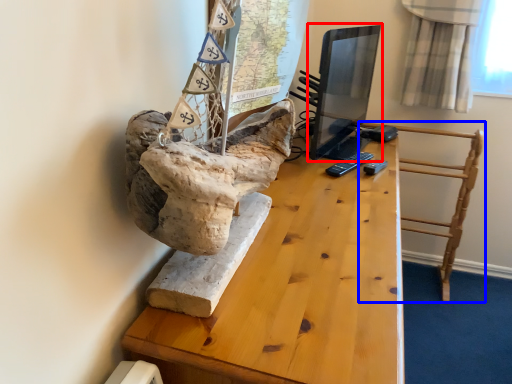
Question: Which object appears closest to the camera in this image, computer monitor (highlighted by a red box) or furniture (highlighted by a blue box)?

Choices:
 (A) computer monitor
 (B) furniture

Answer: (A)